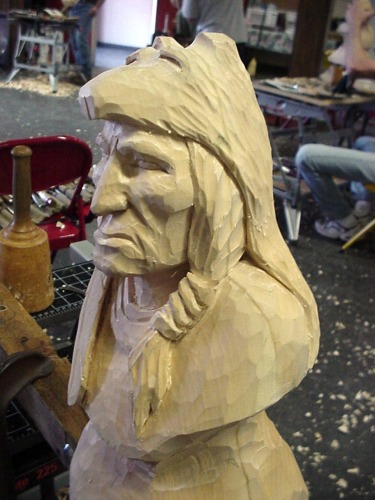
Identify the location of red folding chair. The image size is (375, 500). (56, 172).